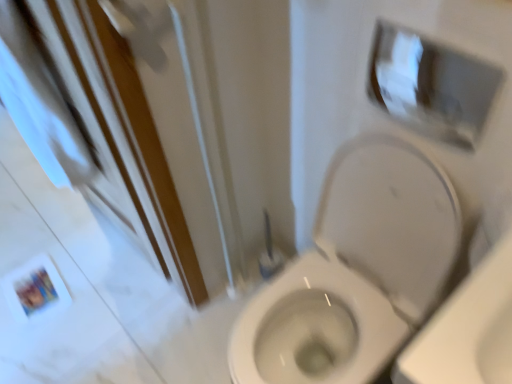
Question: Would you say white glossy toilet at center contains white fabric screen door at lower left?

Choices:
 (A) no
 (B) yes

Answer: (A)

Question: Is white glossy toilet at center in contact with white fabric screen door at lower left?

Choices:
 (A) yes
 (B) no

Answer: (B)

Question: Does white glossy toilet at center appear on the right side of white fabric screen door at lower left?

Choices:
 (A) yes
 (B) no

Answer: (A)

Question: Considering the relative positions of white glossy toilet at center and white fabric screen door at lower left in the image provided, is white glossy toilet at center to the left of white fabric screen door at lower left from the viewer's perspective?

Choices:
 (A) yes
 (B) no

Answer: (B)

Question: Can you confirm if white glossy toilet at center is wider than white fabric screen door at lower left?

Choices:
 (A) no
 (B) yes

Answer: (B)

Question: Is white glossy toilet at center smaller than white fabric screen door at lower left?

Choices:
 (A) no
 (B) yes

Answer: (A)

Question: From the image's perspective, does white glossy medicine cabinet at upper right appear lower than white fabric screen door at lower left?

Choices:
 (A) no
 (B) yes

Answer: (A)

Question: Are white glossy medicine cabinet at upper right and white fabric screen door at lower left located far from each other?

Choices:
 (A) yes
 (B) no

Answer: (B)

Question: From a real-world perspective, does white glossy medicine cabinet at upper right sit lower than white fabric screen door at lower left?

Choices:
 (A) no
 (B) yes

Answer: (A)

Question: Is white glossy medicine cabinet at upper right completely or partially outside of white fabric screen door at lower left?

Choices:
 (A) no
 (B) yes

Answer: (B)

Question: Is white glossy medicine cabinet at upper right behind white fabric screen door at lower left?

Choices:
 (A) yes
 (B) no

Answer: (A)

Question: Is white glossy medicine cabinet at upper right to the left of white fabric screen door at lower left from the viewer's perspective?

Choices:
 (A) no
 (B) yes

Answer: (A)

Question: Considering the relative sizes of white fabric screen door at lower left and white glossy toilet at center in the image provided, is white fabric screen door at lower left thinner than white glossy toilet at center?

Choices:
 (A) yes
 (B) no

Answer: (A)